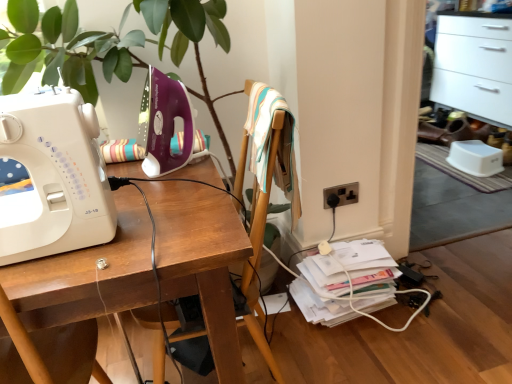
You are a GUI agent. You are given a task and a screenshot of the screen. Output one action in this format:
    pyautogui.click(x=<x>, y=<y>)
    Task: Click on the free point to the left of purple plastic sewing machine at upper left, placed as the second sewing machine when sorted from front to back
    
    Given the screenshot: What is the action you would take?
    pyautogui.click(x=125, y=168)